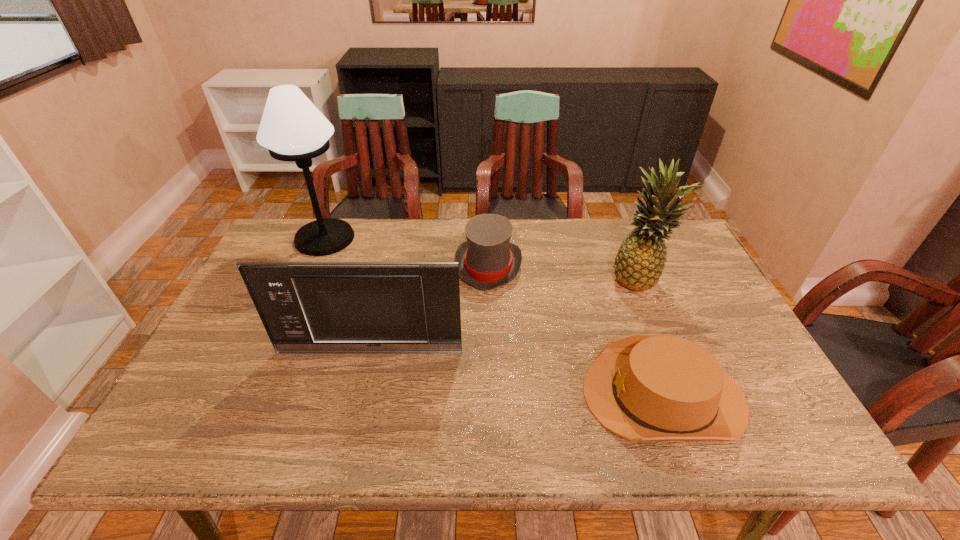
This screenshot has width=960, height=540. In order to click on table lamp in this screenshot , I will do `click(292, 128)`.

The height and width of the screenshot is (540, 960). Find the location of `the fourth shortest object`. the fourth shortest object is located at coordinates (640, 260).

Locate an element on the screen. the third tallest object is located at coordinates (306, 307).

Locate an element on the screen. This screenshot has width=960, height=540. the fourth tallest object is located at coordinates (487, 260).

You are a GUI agent. You are given a task and a screenshot of the screen. Output one action in this format:
    pyautogui.click(x=<x>, y=<y>)
    Task: Click on the shortest object
    This screenshot has height=540, width=960.
    Given the screenshot: What is the action you would take?
    pyautogui.click(x=643, y=387)

This screenshot has height=540, width=960. In order to click on vacant area situated 0.110m on the front of the tallest object in this screenshot , I will do `click(306, 281)`.

At what (x,y) coordinates should I click in order to perform the action: click on vacant space located on the front of the second tallest object. Please return your answer as a coordinate pair (x, y). Looking at the image, I should click on (661, 333).

Where is `vacant region located 0.080m on the front panel of the third tallest object`? Image resolution: width=960 pixels, height=540 pixels. vacant region located 0.080m on the front panel of the third tallest object is located at coordinates (363, 381).

You are a GUI agent. You are given a task and a screenshot of the screen. Output one action in this format:
    pyautogui.click(x=<x>, y=<y>)
    Task: Click on the vacant space located on the right of the dress hat
    This screenshot has height=540, width=960.
    Given the screenshot: What is the action you would take?
    pyautogui.click(x=593, y=266)

Where is `vacant space located on the front-facing side of the cowboy hat`? Image resolution: width=960 pixels, height=540 pixels. vacant space located on the front-facing side of the cowboy hat is located at coordinates (487, 395).